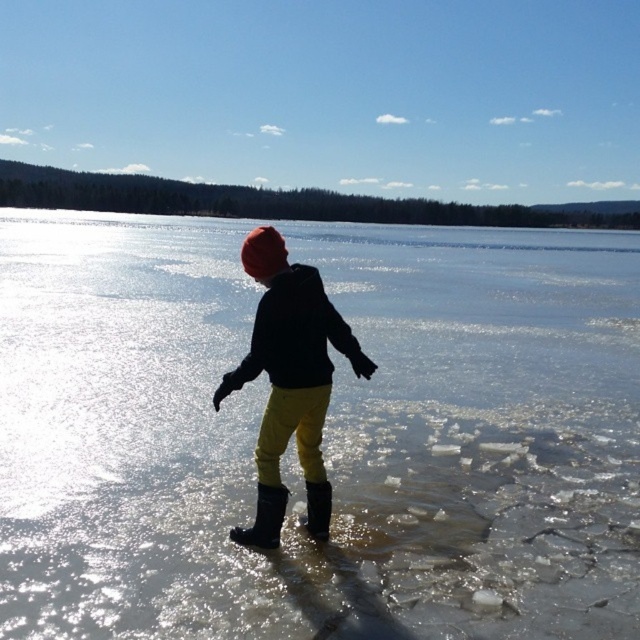
Is yellow matte pants at center positioned in front of black matte jacket at center?

No, yellow matte pants at center is further to the viewer.

Which is in front, point (268, 323) or point (248, 360)?

Point (268, 323) is more forward.

Which is in front, point (301, 432) or point (260, 339)?

Point (260, 339) is in front.

Identify the location of yellow matte pants at center. (288, 372).

Between yellow matte pants at center and rubber boots at center, which one has more height?

Standing taller between the two is yellow matte pants at center.

Between yellow matte pants at center and rubber boots at center, which one appears on the left side from the viewer's perspective?

rubber boots at center

What do you see at coordinates (288, 372) in the screenshot?
I see `yellow matte pants at center` at bounding box center [288, 372].

Image resolution: width=640 pixels, height=640 pixels. Find the location of `yellow matte pants at center`. yellow matte pants at center is located at coordinates (288, 372).

Between point (291, 355) and point (312, 529), which one is positioned behind?

Positioned behind is point (312, 529).

Is black matte jacket at center to the left of black rubber boot at lower center from the viewer's perspective?

Yes, black matte jacket at center is to the left of black rubber boot at lower center.

Is point (282, 356) farther from viewer compared to point (321, 538)?

No, it is in front of (321, 538).

Image resolution: width=640 pixels, height=640 pixels. I want to click on black matte jacket at center, so click(296, 336).